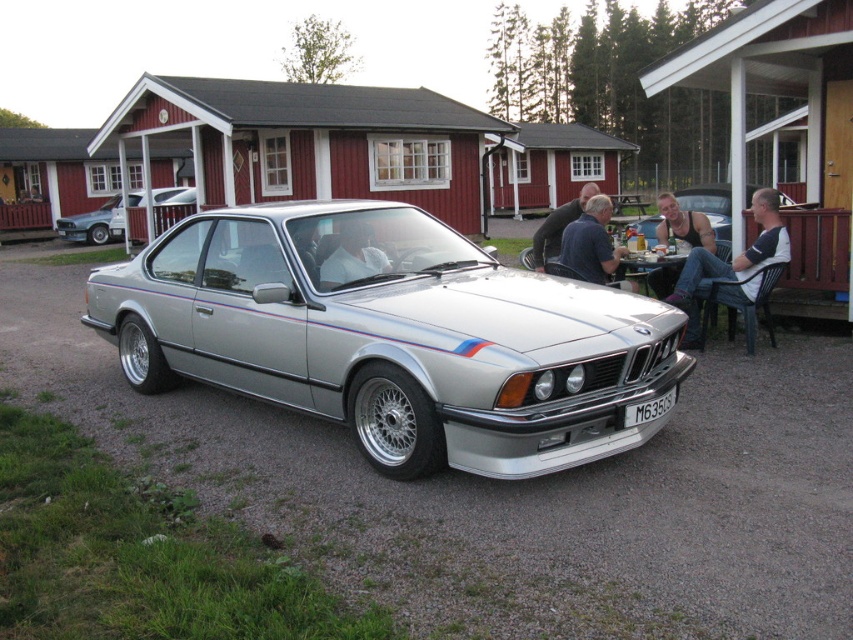
Question: Which of the following is the closest to the observer?

Choices:
 (A) (741, 257)
 (B) (647, 401)
 (C) (323, 241)
 (D) (631, 300)

Answer: (B)

Question: Does silver metallic car at center have a lesser width compared to black plastic license plate at center?

Choices:
 (A) no
 (B) yes

Answer: (A)

Question: Is matte black tank top at right smaller than silver metallic car at upper left?

Choices:
 (A) yes
 (B) no

Answer: (B)

Question: Which object is positioned closest to the matte black tank top at right?

Choices:
 (A) silver metallic car at upper left
 (B) dark blue shirt at center
 (C) tank top at center

Answer: (C)

Question: Is white fabric at center wider than silver metallic car at upper left?

Choices:
 (A) no
 (B) yes

Answer: (A)

Question: Which object appears closest to the camera in this image?

Choices:
 (A) silver metallic car at center
 (B) tank top at center

Answer: (A)